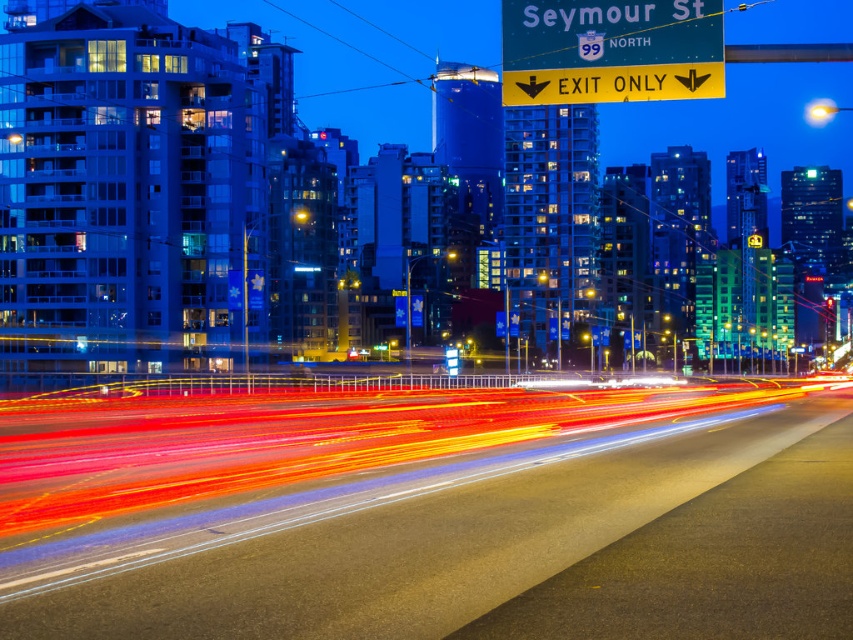
Does metallic asphalt highway at center appear over yellow plastic sign at upper center?

Actually, metallic asphalt highway at center is below yellow plastic sign at upper center.

Can you confirm if metallic asphalt highway at center is bigger than yellow plastic sign at upper center?

Yes.

Locate an element on the screen. metallic asphalt highway at center is located at coordinates (343, 512).